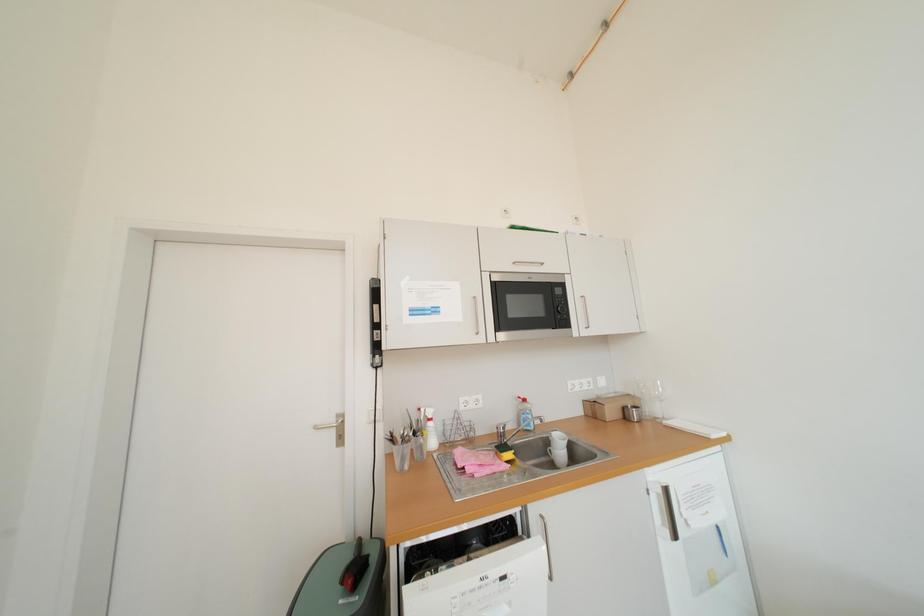
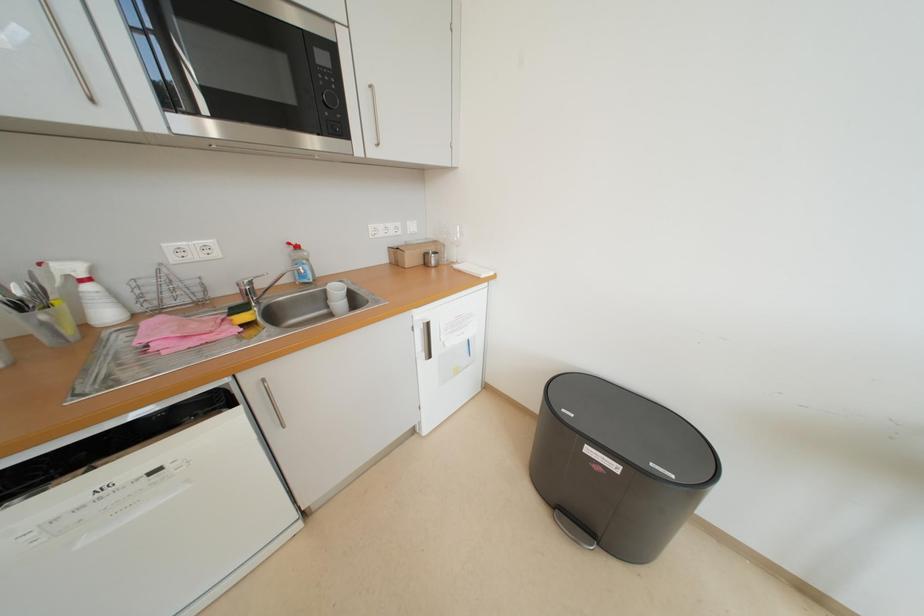
From the picture: How did the camera likely rotate?

The camera rotated toward right-down.